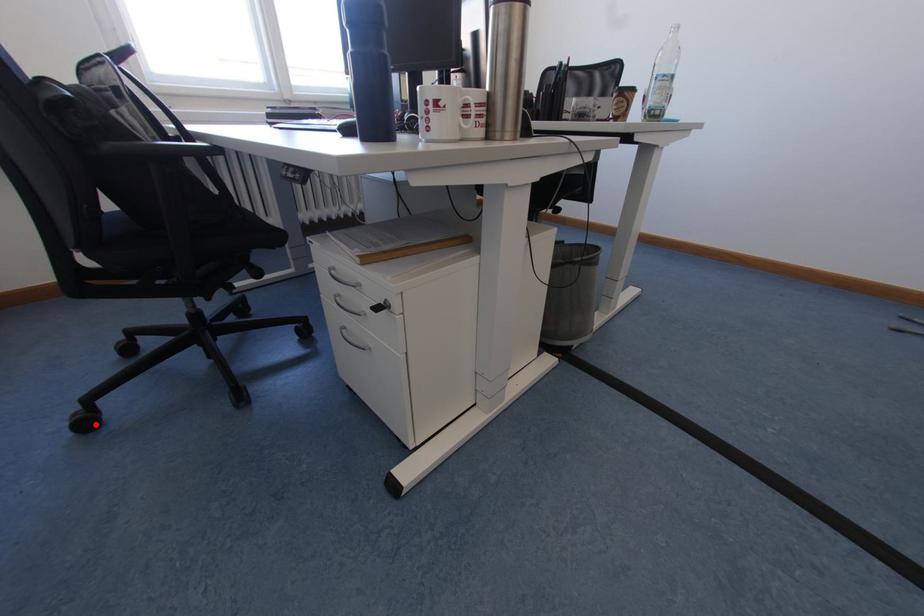
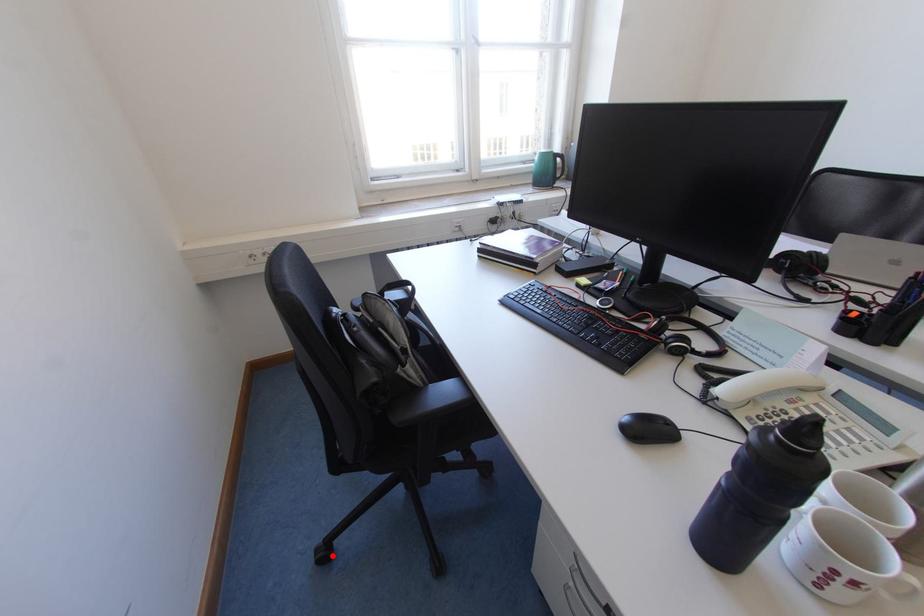
I am providing you with two images of the same scene from different viewpoints. A red point is marked on the first image and another point is marked on the second image. Is the marked point in image1 the same physical position as the marked point in image2?

Yes